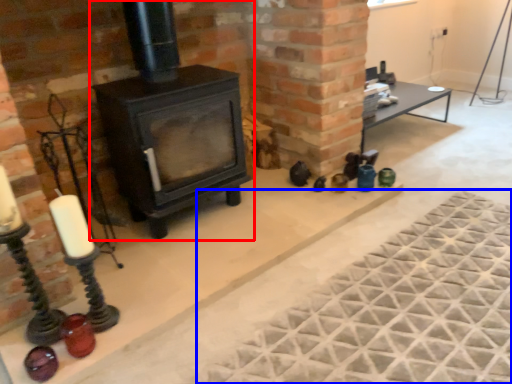
Question: Which point is further to the camera, wood burning stove (highlighted by a red box) or mat (highlighted by a blue box)?

Choices:
 (A) wood burning stove
 (B) mat

Answer: (A)